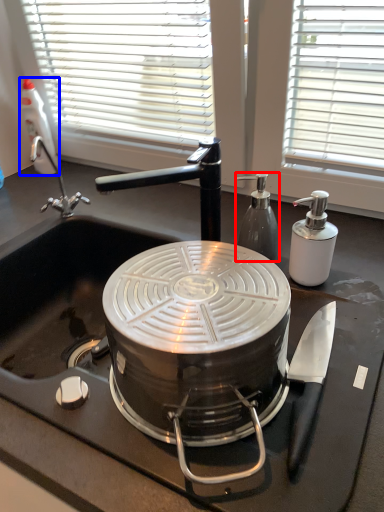
Question: Which object is closer to the camera taking this photo, kitchen appliance (highlighted by a red box) or bottle (highlighted by a blue box)?

Choices:
 (A) kitchen appliance
 (B) bottle

Answer: (A)